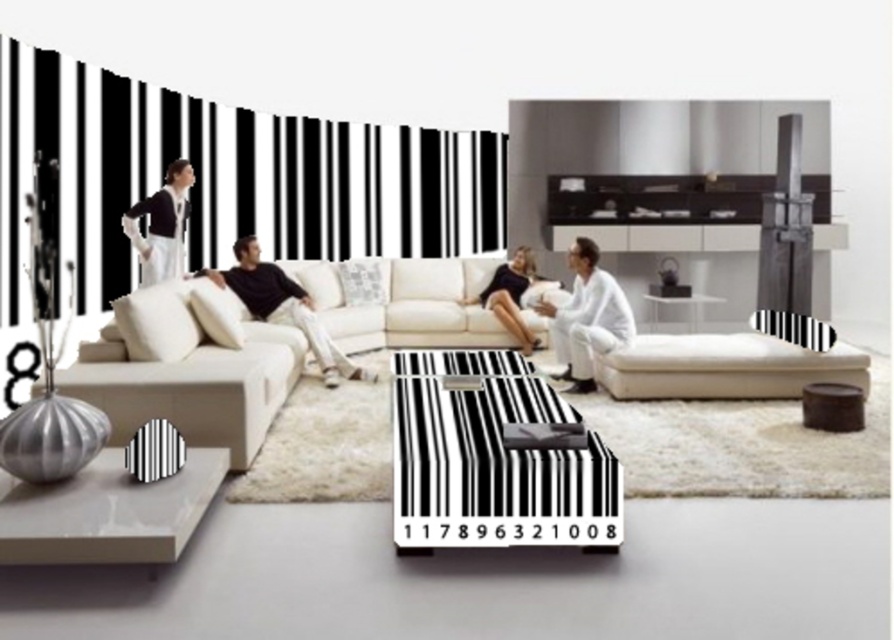
Question: Does white leather couch at center come in front of beige fabric sofa at center?

Choices:
 (A) yes
 (B) no

Answer: (A)

Question: Which is nearer to the matte white coffee table at lower left?

Choices:
 (A) white leather couch at center
 (B) white matte couch at center
 (C) matte black couch at center

Answer: (A)

Question: Which object appears farthest from the camera in this image?

Choices:
 (A) white glossy shelf at center
 (B) black glossy coffee table at center
 (C) white matte couch at center
 (D) matte black dress at upper left

Answer: (A)

Question: Observing the image, what is the correct spatial positioning of white leather couch at center in reference to matte black dress at upper left?

Choices:
 (A) right
 (B) left

Answer: (A)

Question: Where is matte white coffee table at lower left located in relation to matte black dress at center in the image?

Choices:
 (A) left
 (B) right

Answer: (A)

Question: Which point is farther to the camera?

Choices:
 (A) white leather couch at center
 (B) white glossy shelf at center
 (C) white matte couch at center
 (D) matte white coffee table at lower left

Answer: (B)